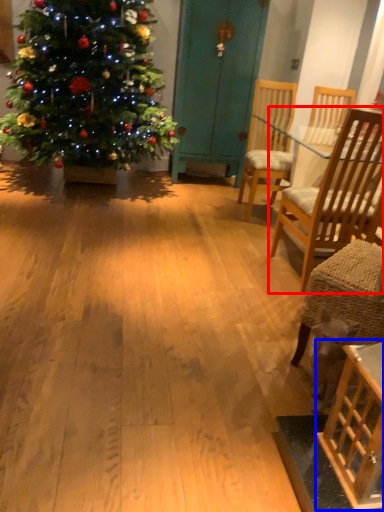
Question: Which object is further to the camera taking this photo, chair (highlighted by a red box) or table (highlighted by a blue box)?

Choices:
 (A) chair
 (B) table

Answer: (A)